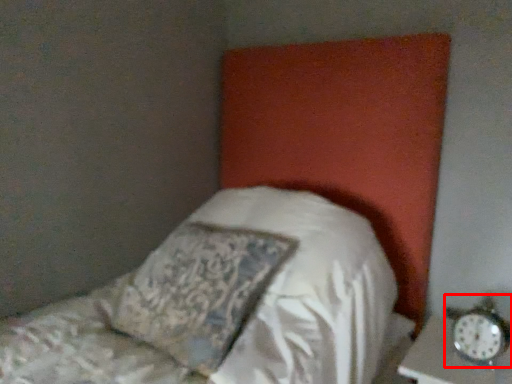
Question: Observing the image, what is the correct spatial positioning of alarm clock (annotated by the red box) in reference to pillow?

Choices:
 (A) left
 (B) right

Answer: (B)